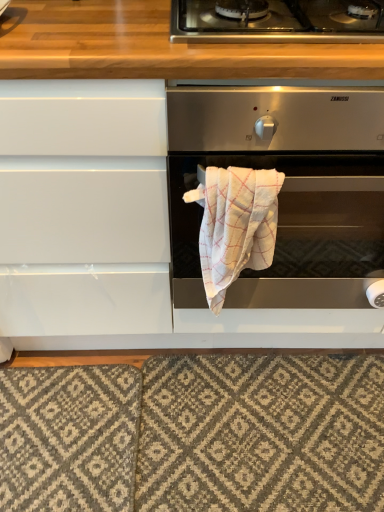
At what (x,y) coordinates should I click in order to perform the action: click on free space above textured gray rug at lower center (from a real-world perspective). Please return your answer as a coordinate pair (x, y). Looking at the image, I should click on (196, 408).